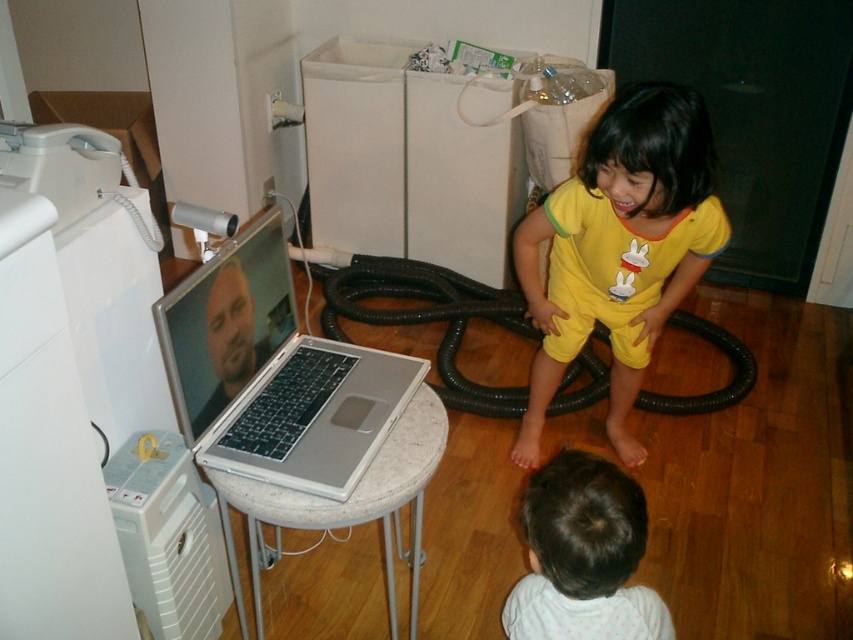
How far apart are yellow cotton onesie at center and light brown hair at lower center?

They are 28.89 inches apart.

Is point (624, 333) behind point (604, 490)?

Yes.

Find the location of `yellow cotton onesie at center`. yellow cotton onesie at center is located at coordinates (619, 248).

Is point (683, 209) less distant than point (242, 336)?

That is True.

Is yellow cotton onesie at center thinner than silver metallic laptop at center?

Yes, yellow cotton onesie at center is thinner than silver metallic laptop at center.

Find the location of a particular element. The image size is (853, 640). yellow cotton onesie at center is located at coordinates (619, 248).

Find the location of `yellow cotton onesie at center`. yellow cotton onesie at center is located at coordinates (619, 248).

Is silver metallic laptop at center to the left of silver metallic stool at center from the viewer's perspective?

Indeed, silver metallic laptop at center is positioned on the left side of silver metallic stool at center.

Is silver metallic laptop at center shorter than silver metallic stool at center?

Correct, silver metallic laptop at center is not as tall as silver metallic stool at center.

Find the location of a particular element. silver metallic laptop at center is located at coordinates (273, 374).

Locate an element on the screen. The height and width of the screenshot is (640, 853). silver metallic laptop at center is located at coordinates (273, 374).